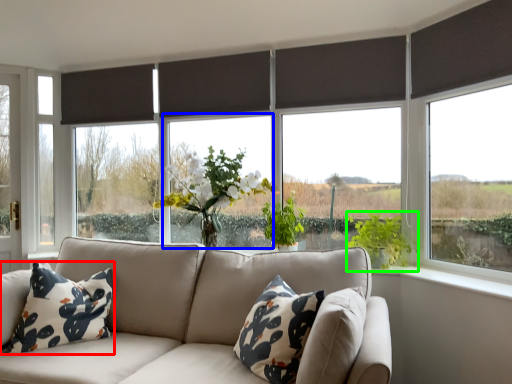
Question: Considering the real-world distances, which object is farthest from pillow (highlighted by a red box)? window (highlighted by a blue box) or vegetation (highlighted by a green box)?

Choices:
 (A) window
 (B) vegetation

Answer: (B)